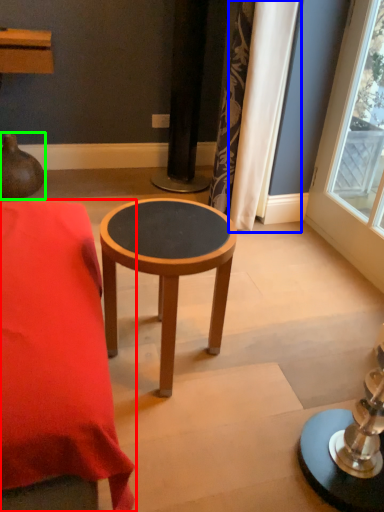
Question: Which object is positioned closest to table (highlighted by a red box)? Select from curtain (highlighted by a blue box) and vase (highlighted by a green box).

Choices:
 (A) curtain
 (B) vase

Answer: (A)